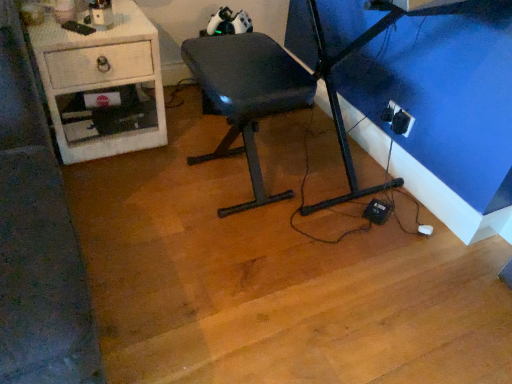
The width and height of the screenshot is (512, 384). What are the coordinates of `free spot in front of white glossy desk at left` in the screenshot? It's located at (116, 191).